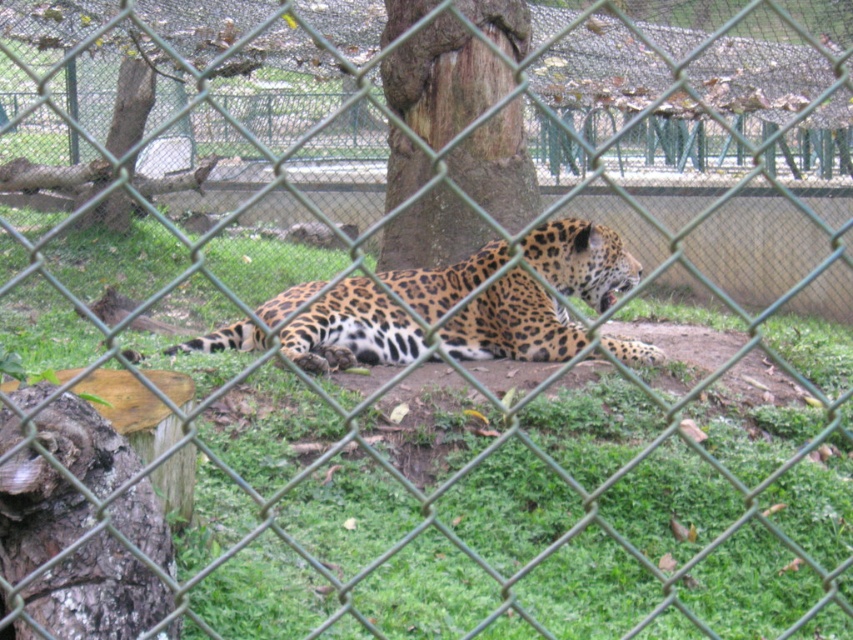
Which is more to the left, spotted fur jaguar at center or brown rough bark at center?

spotted fur jaguar at center is more to the left.

The height and width of the screenshot is (640, 853). Describe the element at coordinates (351, 330) in the screenshot. I see `spotted fur jaguar at center` at that location.

Who is more forward, (525, 339) or (445, 161)?

Positioned in front is point (525, 339).

Find the location of a particular element. spotted fur jaguar at center is located at coordinates (351, 330).